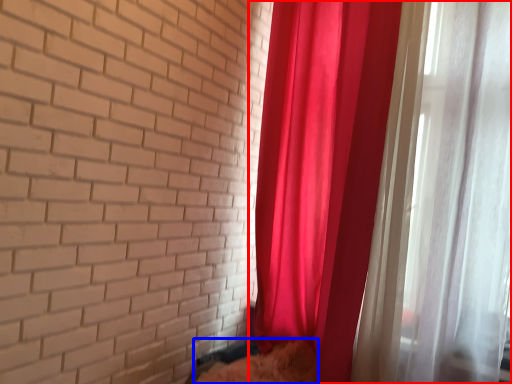
Question: Which object appears closest to the camera in this image, curtain (highlighted by a red box) or animal (highlighted by a blue box)?

Choices:
 (A) curtain
 (B) animal

Answer: (A)